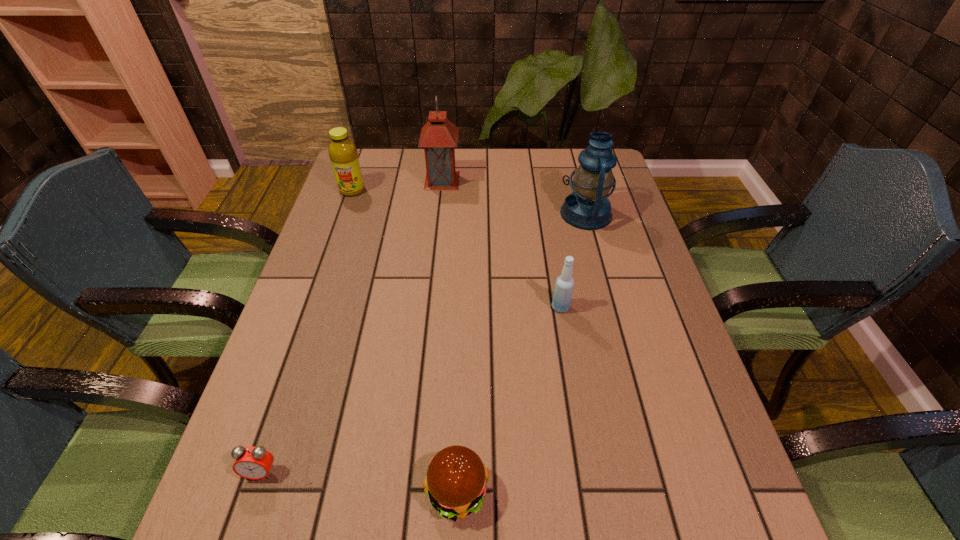
Image resolution: width=960 pixels, height=540 pixels. Identify the location of free spot located 0.170m on the face of the right lantern. (504, 214).

Locate an element on the screen. This screenshot has width=960, height=540. free space located on the face of the right lantern is located at coordinates (484, 214).

You are a GUI agent. You are given a task and a screenshot of the screen. Output one action in this format:
    pyautogui.click(x=<x>, y=<y>)
    Task: Click on the blank space located on the front label of the third tallest object
    The image size is (960, 540).
    Given the screenshot: What is the action you would take?
    pyautogui.click(x=331, y=252)

You are a GUI agent. You are given a task and a screenshot of the screen. Output one action in this format:
    pyautogui.click(x=<x>, y=<y>)
    Task: Click on the free space located on the back of the third nearest object
    The image size is (960, 540).
    Given the screenshot: What is the action you would take?
    pyautogui.click(x=543, y=203)

I want to click on vacant space located 0.130m on the back of the fifth tallest object, so click(x=461, y=396).

At what (x,y) coordinates should I click in order to perform the action: click on vacant space situated on the front-facing side of the shortest object. Please return your answer as a coordinate pair (x, y). The height and width of the screenshot is (540, 960). Looking at the image, I should click on (248, 513).

You are a GUI agent. You are given a task and a screenshot of the screen. Output one action in this format:
    pyautogui.click(x=<x>, y=<y>)
    Task: Click on the lantern at the far edge
    This screenshot has width=960, height=540.
    Given the screenshot: What is the action you would take?
    pyautogui.click(x=439, y=136)

The width and height of the screenshot is (960, 540). In order to click on fruit juice that is positioned at the far edge in this screenshot , I will do `click(343, 154)`.

Identify the location of object located at the near edge. (456, 479).

Locate an element on the screen. This screenshot has width=960, height=540. fruit juice that is at the left edge is located at coordinates (343, 154).